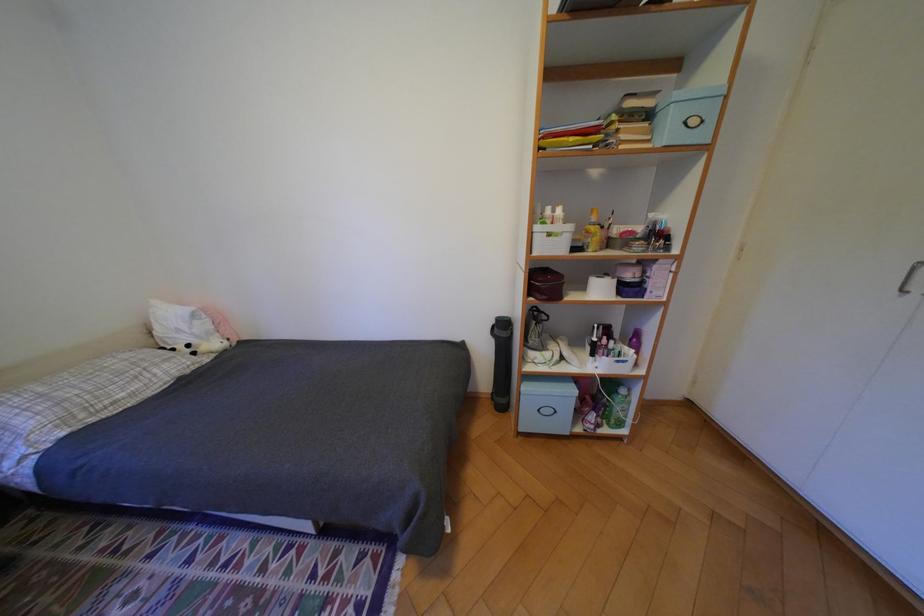
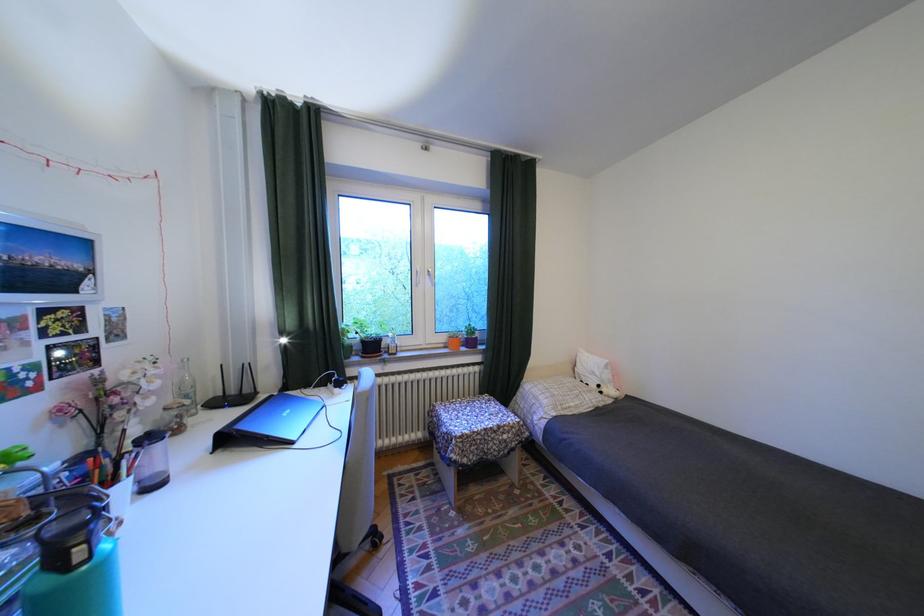
Question: The camera is either moving clockwise (left) or counter-clockwise (right) around the object. The first image is from the beginning of the video and the second image is from the end. Is the camera moving left or right when shooting the video?

Choices:
 (A) Left
 (B) Right

Answer: (B)